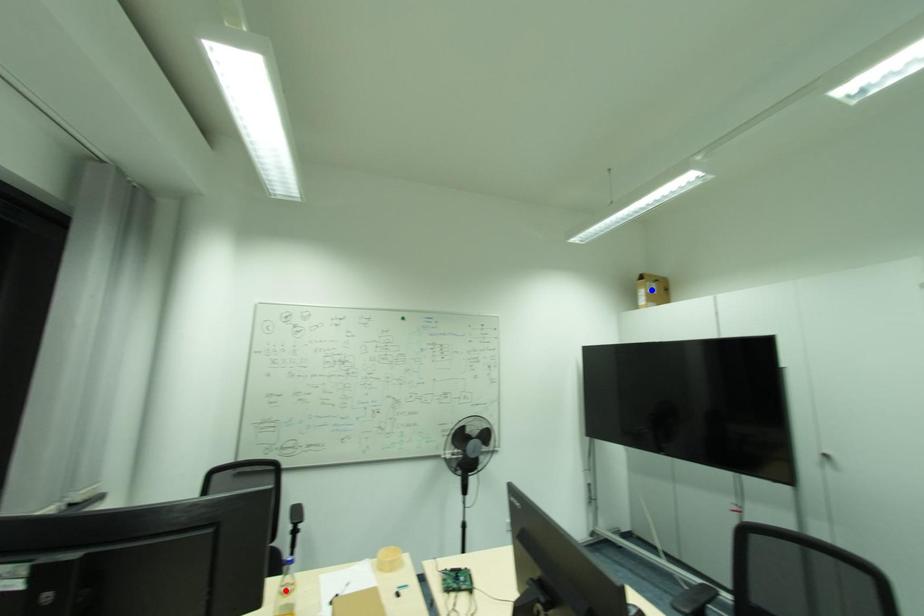
Question: Which of the two points in the image is closer to the camera?

Choices:
 (A) Blue point is closer.
 (B) Red point is closer.

Answer: (B)